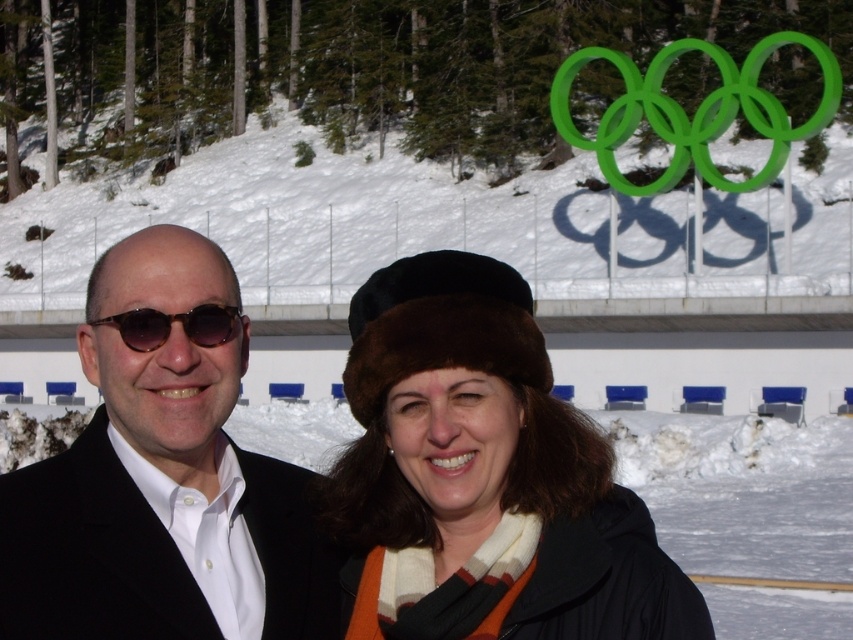
Which is above, brown fur hat at center or tortoiseshell plastic sunglasses at left?

Positioned higher is tortoiseshell plastic sunglasses at left.

Describe the element at coordinates (488, 465) in the screenshot. I see `brown fur hat at center` at that location.

You are a GUI agent. You are given a task and a screenshot of the screen. Output one action in this format:
    pyautogui.click(x=<x>, y=<y>)
    Task: Click on the brown fur hat at center
    Image resolution: width=853 pixels, height=640 pixels.
    Given the screenshot: What is the action you would take?
    pyautogui.click(x=488, y=465)

This screenshot has width=853, height=640. I want to click on brown fur hat at center, so click(488, 465).

Between brown fur hat at center and black matte suit at left, which one has more height?

black matte suit at left

Which is behind, point (502, 305) or point (152, 348)?

Point (502, 305)

You are a GUI agent. You are given a task and a screenshot of the screen. Output one action in this format:
    pyautogui.click(x=<x>, y=<y>)
    Task: Click on the brown fur hat at center
    The image size is (853, 640).
    Given the screenshot: What is the action you would take?
    click(x=488, y=465)

Between black matte suit at left and tortoiseshell plastic sunglasses at left, which one is positioned higher?

Positioned higher is tortoiseshell plastic sunglasses at left.

Between black matte suit at left and tortoiseshell plastic sunglasses at left, which one appears on the left side from the viewer's perspective?

black matte suit at left

Does point (332, 557) come closer to viewer compared to point (126, 317)?

No, (332, 557) is behind (126, 317).

This screenshot has width=853, height=640. Find the location of `black matte suit at left`. black matte suit at left is located at coordinates (161, 474).